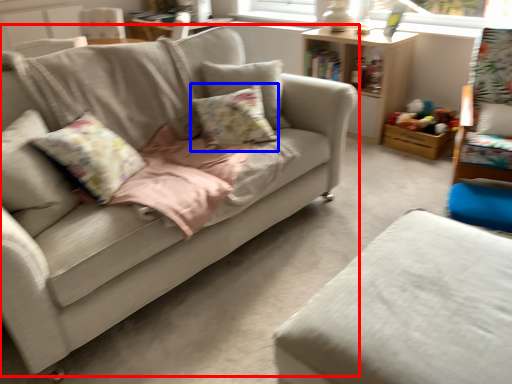
Question: Which object appears farthest to the camera in this image, studio couch (highlighted by a red box) or pillow (highlighted by a blue box)?

Choices:
 (A) studio couch
 (B) pillow

Answer: (B)